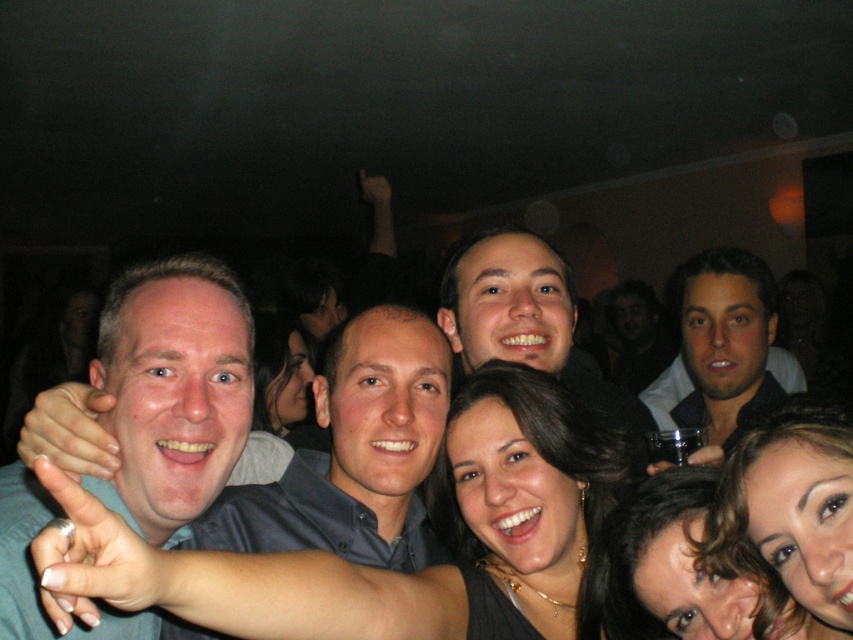
Question: Is smooth black hair at center above metallic silver ring at lower center?

Choices:
 (A) no
 (B) yes

Answer: (B)

Question: Considering the real-world distances, which object is farthest from the matte gray shirt at lower left?

Choices:
 (A) metallic silver ring at lower center
 (B) smooth brown hair at lower right
 (C) matte black hair at center

Answer: (A)

Question: Which point appears farthest from the camera in this image?

Choices:
 (A) (573, 324)
 (B) (787, 538)

Answer: (A)

Question: Which object is positioned farthest from the matte gray shirt at lower left?

Choices:
 (A) smooth brown hair at lower right
 (B) smooth black hair at center
 (C) metallic silver ring at lower center

Answer: (B)

Question: Does smooth skin face at center appear over smooth black hair at center?

Choices:
 (A) no
 (B) yes

Answer: (B)

Question: Is matte gray shirt at center above matte gray shirt at lower left?

Choices:
 (A) yes
 (B) no

Answer: (B)